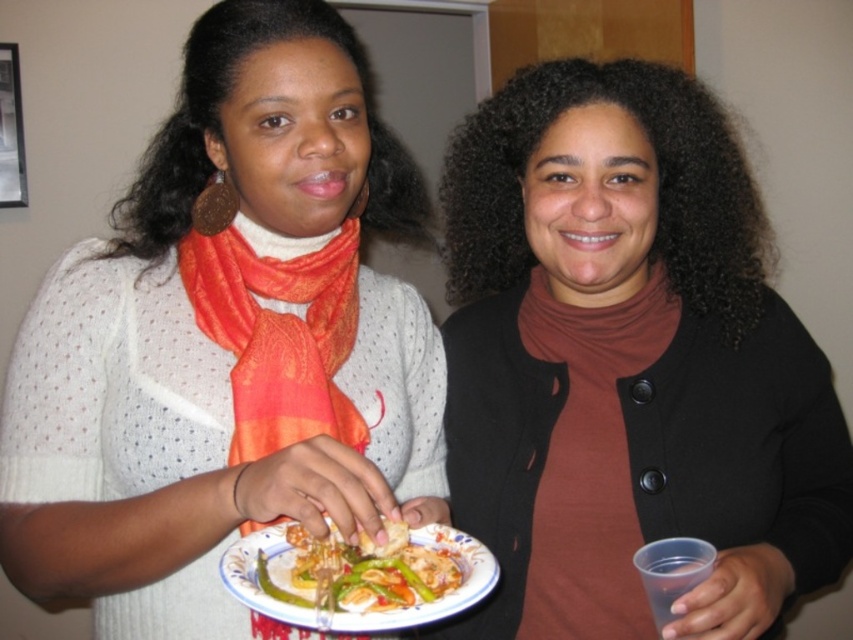
You are at a party and want to find the matte orange scarf at center. The host says it is located at coordinate point (223, 342). If you are standing at coordinate point 0.4, 0.3, which direction should you move to reach the matte orange scarf at center?

The matte orange scarf at center is located at coordinate point (223, 342). Since you are at point 0.4, 0.3, you should move northeast to reach it.